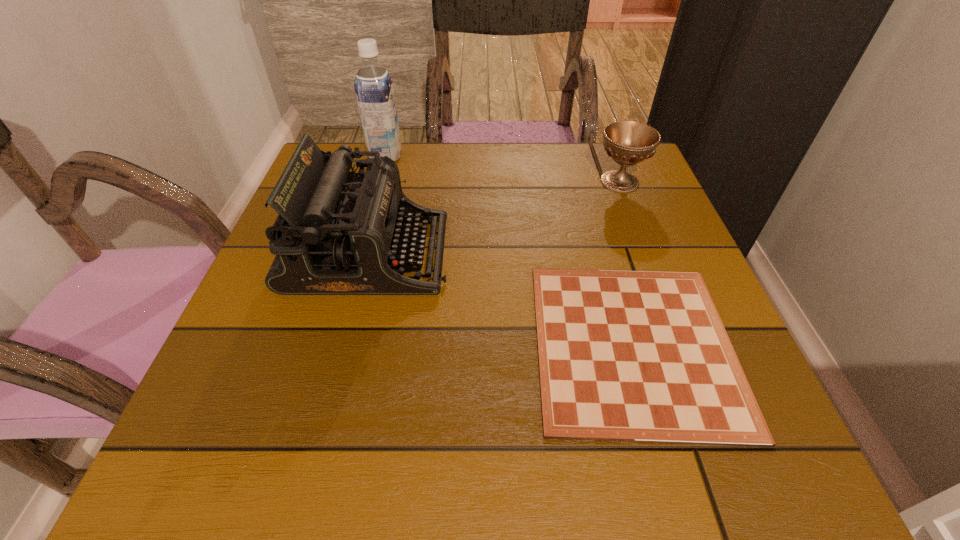
Image resolution: width=960 pixels, height=540 pixels. Find the location of `soya milk that is positioned at the far edge`. soya milk that is positioned at the far edge is located at coordinates (374, 90).

The image size is (960, 540). What are the coordinates of `chalice that is at the far edge` in the screenshot? It's located at (x=627, y=142).

You are a GUI agent. You are given a task and a screenshot of the screen. Output one action in this format:
    pyautogui.click(x=<x>, y=<y>)
    Task: Click on the object that is at the near edge
    
    Given the screenshot: What is the action you would take?
    634,356

The image size is (960, 540). Find the location of `soya milk present at the left edge`. soya milk present at the left edge is located at coordinates (374, 90).

In order to click on typewriter present at the left edge in this screenshot , I will do pyautogui.click(x=338, y=232).

This screenshot has height=540, width=960. What are the coordinates of `chalice situated at the right edge` in the screenshot? It's located at (627, 142).

Image resolution: width=960 pixels, height=540 pixels. I want to click on checkerboard at the right edge, so click(634, 356).

Where is `object situated at the far left corner`? object situated at the far left corner is located at coordinates (374, 90).

Where is `object at the far right corner`? object at the far right corner is located at coordinates (627, 142).

The width and height of the screenshot is (960, 540). I want to click on object positioned at the near right corner, so click(634, 356).